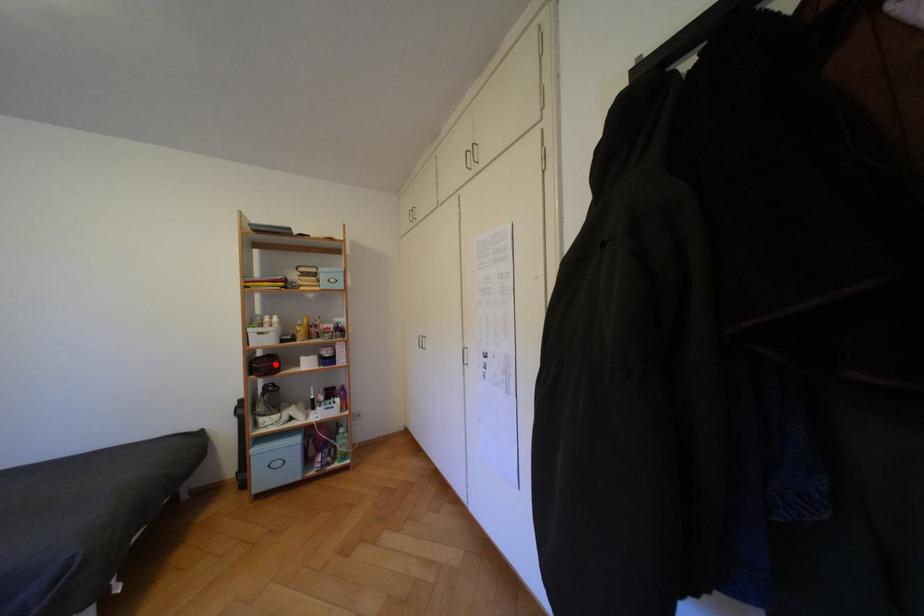
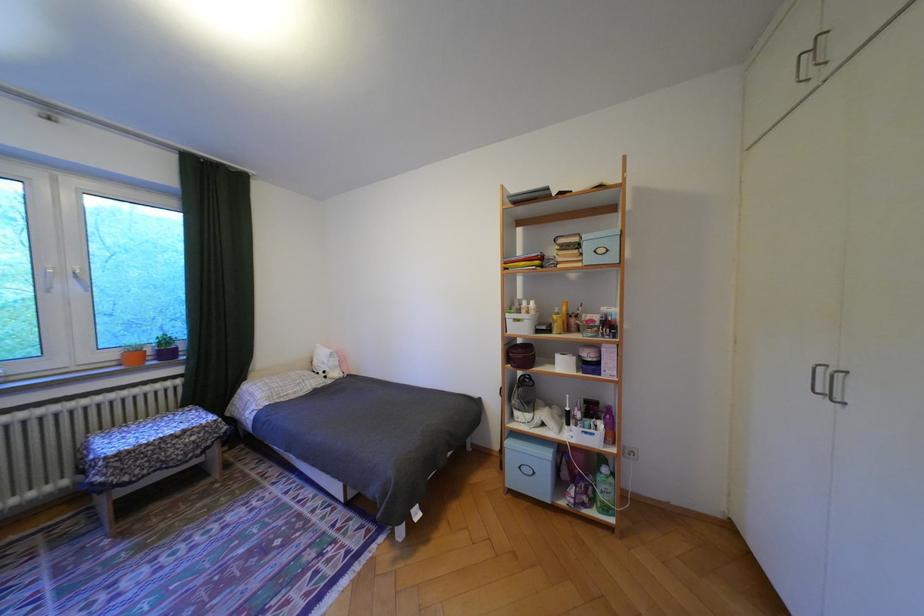
Where in the second image is the point corresponding to the highlighted location from the first image?

(531, 355)